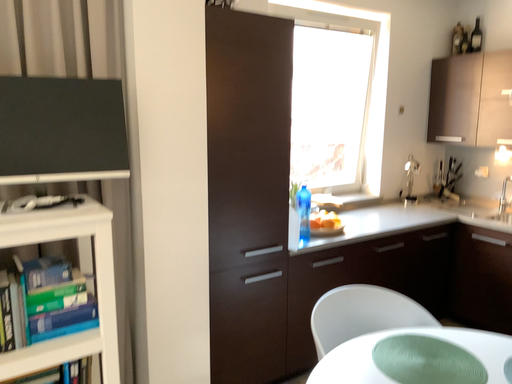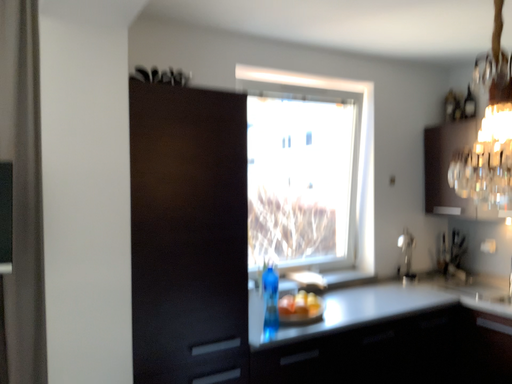
Question: Which way did the camera rotate in the video?

Choices:
 (A) rotated downward
 (B) rotated upward

Answer: (B)